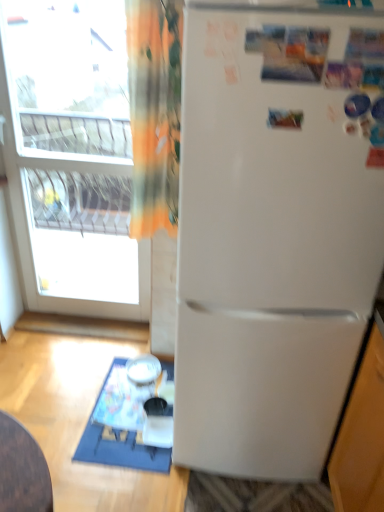
Question: From the image's perspective, is transparent glass window at upper left located above white plastic table at lower left?

Choices:
 (A) yes
 (B) no

Answer: (A)

Question: Is transparent glass window at upper left positioned beyond the bounds of white plastic table at lower left?

Choices:
 (A) no
 (B) yes

Answer: (B)

Question: From a real-world perspective, does transparent glass window at upper left sit lower than white plastic table at lower left?

Choices:
 (A) no
 (B) yes

Answer: (A)

Question: Is transparent glass window at upper left further to the viewer compared to white plastic table at lower left?

Choices:
 (A) yes
 (B) no

Answer: (B)

Question: Can you confirm if transparent glass window at upper left is thinner than white plastic table at lower left?

Choices:
 (A) no
 (B) yes

Answer: (B)

Question: From their relative heights in the image, would you say white matte refrigerator at center is taller or shorter than white plastic table at lower left?

Choices:
 (A) short
 (B) tall

Answer: (B)

Question: In terms of size, does white matte refrigerator at center appear bigger or smaller than white plastic table at lower left?

Choices:
 (A) small
 (B) big

Answer: (B)

Question: From a real-world perspective, is white matte refrigerator at center physically located above or below white plastic table at lower left?

Choices:
 (A) above
 (B) below

Answer: (A)

Question: Is point (258, 349) closer or farther from the camera than point (135, 441)?

Choices:
 (A) closer
 (B) farther

Answer: (A)

Question: In terms of width, does white plastic table at lower left look wider or thinner when compared to white glossy bowl at lower center?

Choices:
 (A) thin
 (B) wide

Answer: (B)

Question: From a real-world perspective, relative to white glossy bowl at lower center, is white plastic table at lower left vertically above or below?

Choices:
 (A) below
 (B) above

Answer: (A)

Question: In terms of height, does white plastic table at lower left look taller or shorter compared to white glossy bowl at lower center?

Choices:
 (A) short
 (B) tall

Answer: (A)

Question: Is point (102, 454) positioned closer to the camera than point (132, 361)?

Choices:
 (A) closer
 (B) farther

Answer: (A)

Question: From the image's perspective, is white glossy bowl at lower center above or below transparent glass window at upper left?

Choices:
 (A) below
 (B) above

Answer: (A)

Question: In terms of size, does white glossy bowl at lower center appear bigger or smaller than transparent glass window at upper left?

Choices:
 (A) big
 (B) small

Answer: (B)